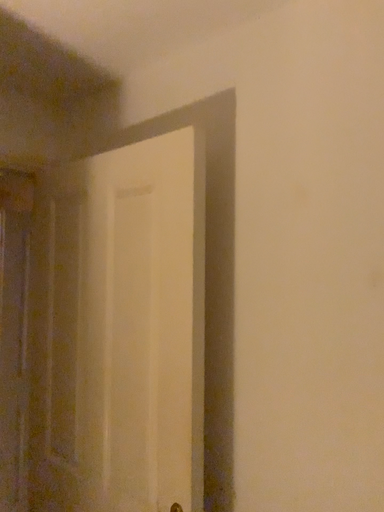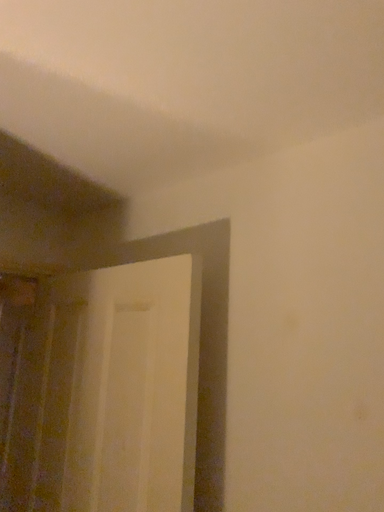
Question: How did the camera likely rotate when shooting the video?

Choices:
 (A) rotated downward
 (B) rotated upward

Answer: (B)